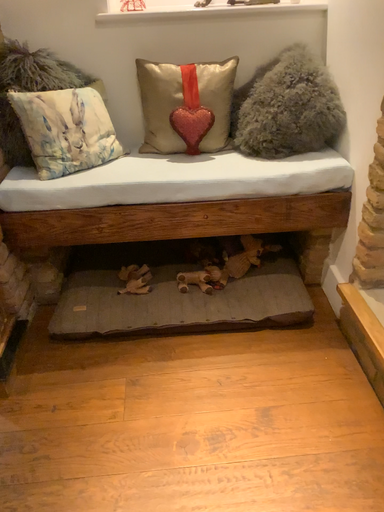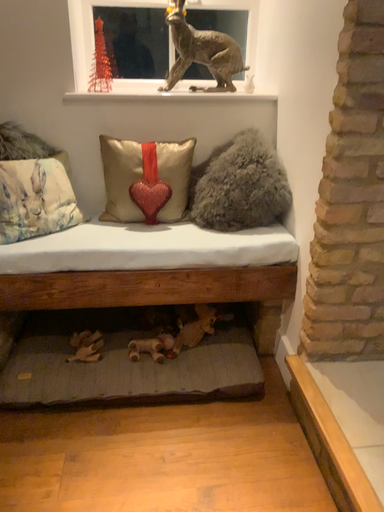
Question: Which way did the camera rotate in the video?

Choices:
 (A) rotated downward
 (B) rotated upward

Answer: (B)